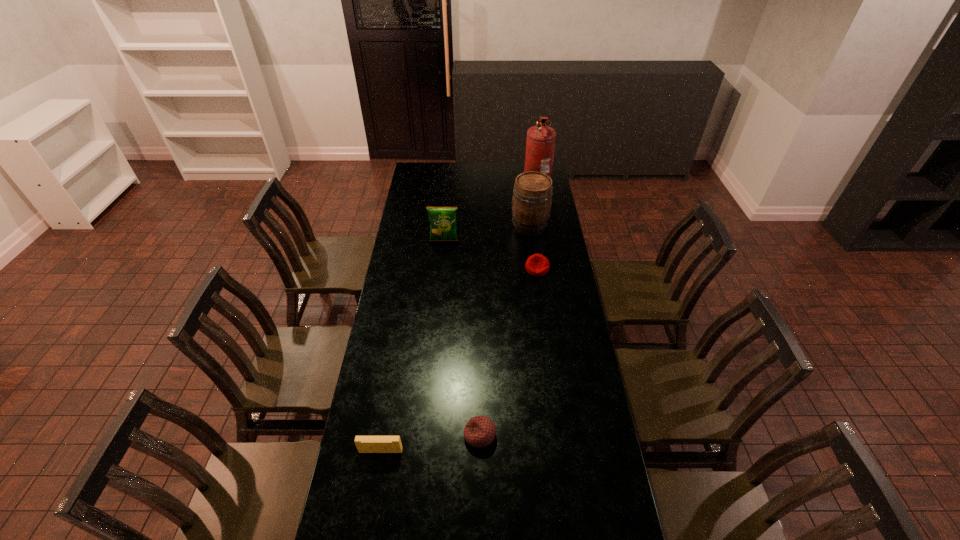
Identify the location of vacant space located 0.070m on the front of the third object from left to right. (480, 472).

Identify the location of object at the far edge. The height and width of the screenshot is (540, 960). [540, 143].

At what (x,y) coordinates should I click in order to perform the action: click on object present at the left edge. Please return your answer as a coordinate pair (x, y). The image size is (960, 540). Looking at the image, I should click on pos(365,444).

Locate an element on the screen. This screenshot has width=960, height=540. fire extinguisher present at the right edge is located at coordinates (540, 143).

I want to click on cider that is at the right edge, so click(x=531, y=203).

Locate an element on the screen. This screenshot has height=540, width=960. beanbag that is at the right edge is located at coordinates (537, 265).

You are a GUI agent. You are given a task and a screenshot of the screen. Output one action in this format:
    pyautogui.click(x=<x>, y=<y>)
    Task: Click on the object that is at the far right corner
    Image resolution: width=960 pixels, height=540 pixels.
    Given the screenshot: What is the action you would take?
    pyautogui.click(x=540, y=143)

In the image, there is a desktop. Identify the location of free space at the left edge. The width and height of the screenshot is (960, 540). (414, 250).

The width and height of the screenshot is (960, 540). I want to click on vacant region at the right edge of the desktop, so click(561, 227).

Where is `vacant space at the far left corner of the desktop`? vacant space at the far left corner of the desktop is located at coordinates pyautogui.click(x=430, y=179).